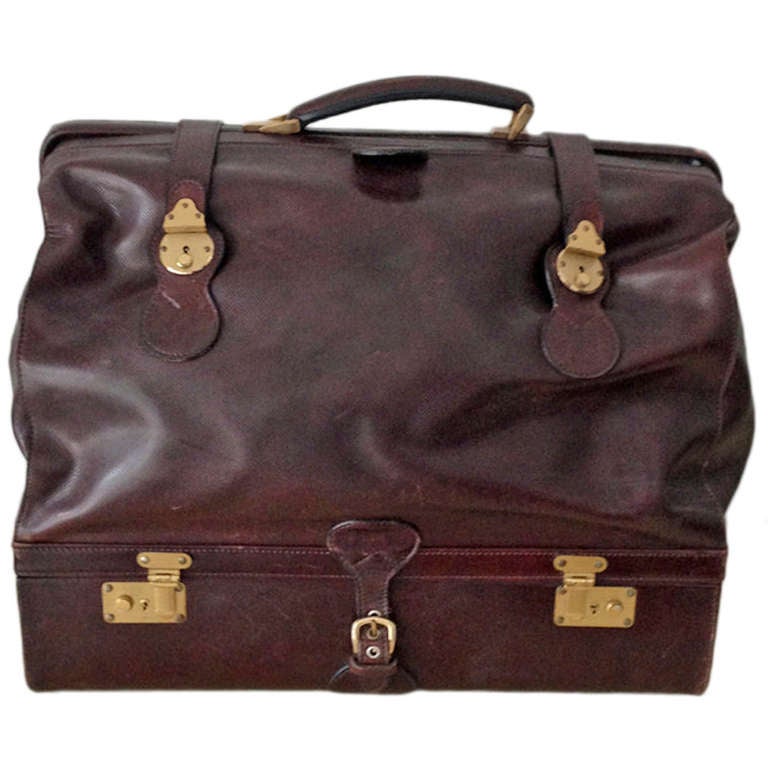
This screenshot has width=768, height=768. I want to click on gold accents, so click(584, 624).